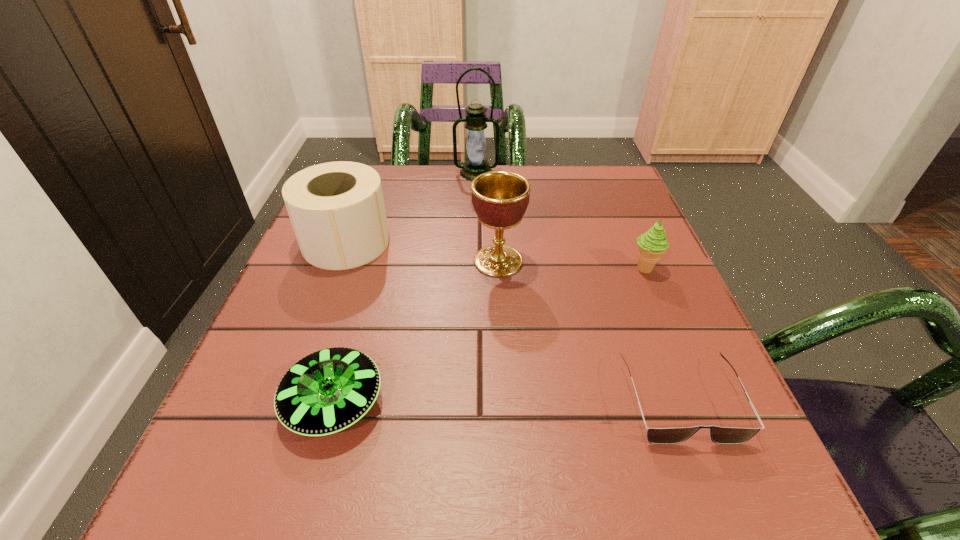
This screenshot has height=540, width=960. Find the location of `free space at the right edge of the desktop`. free space at the right edge of the desktop is located at coordinates (684, 413).

The height and width of the screenshot is (540, 960). I want to click on blank area at the far left corner, so click(x=384, y=199).

In the image, there is a desktop. Where is `vacant space at the near left corner`? vacant space at the near left corner is located at coordinates (188, 505).

You are a GUI agent. You are given a task and a screenshot of the screen. Output one action in this format:
    pyautogui.click(x=<x>, y=<y>)
    Task: Click on the vacant region at the far right corner of the desktop
    The image size is (960, 540).
    Given the screenshot: What is the action you would take?
    pyautogui.click(x=623, y=176)

In the image, there is a desktop. At what (x,y) coordinates should I click in order to perform the action: click on vacant space at the near right corner. Please return your answer as a coordinate pair (x, y). This screenshot has width=960, height=540. Looking at the image, I should click on (765, 482).

In order to click on vacant area that lies between the toilet tissue and the shortest object in this screenshot , I will do `click(513, 321)`.

I want to click on free space between the fourth tallest object and the shortest object, so click(x=662, y=334).

What are the coordinates of `blank region between the fifth tallest object and the farthest object` in the screenshot? It's located at (405, 288).

At what (x,y) coordinates should I click in order to perform the action: click on free spot between the chalice and the toilet tissue. Please return your answer as a coordinate pair (x, y). Looking at the image, I should click on (422, 252).

At what (x,y) coordinates should I click in order to perform the action: click on free space between the tallest object and the toilet tissue. Please return your answer as a coordinate pair (x, y). The height and width of the screenshot is (540, 960). Looking at the image, I should click on (411, 207).